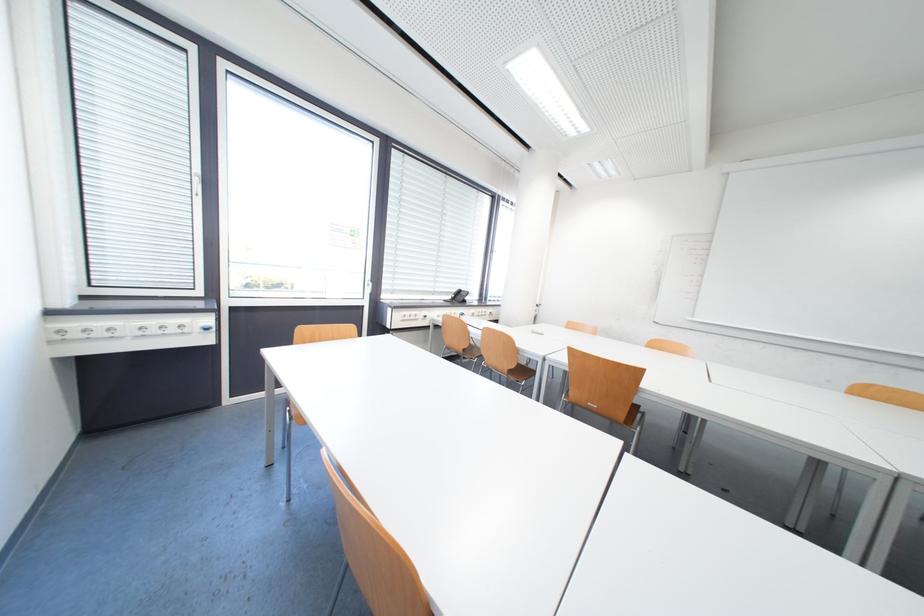
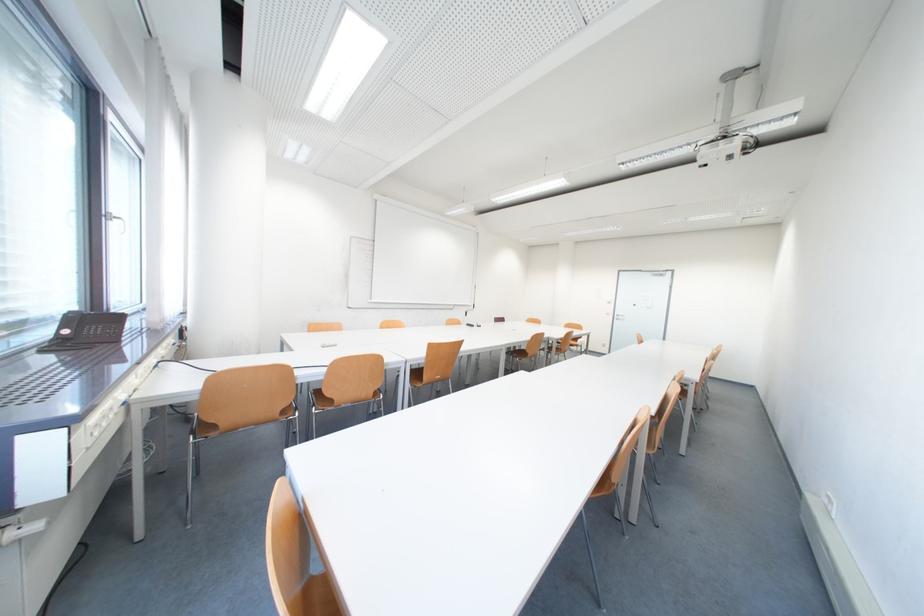
The point at (471, 352) is marked in the first image. Where is the corresponding point in the second image?

(287, 416)